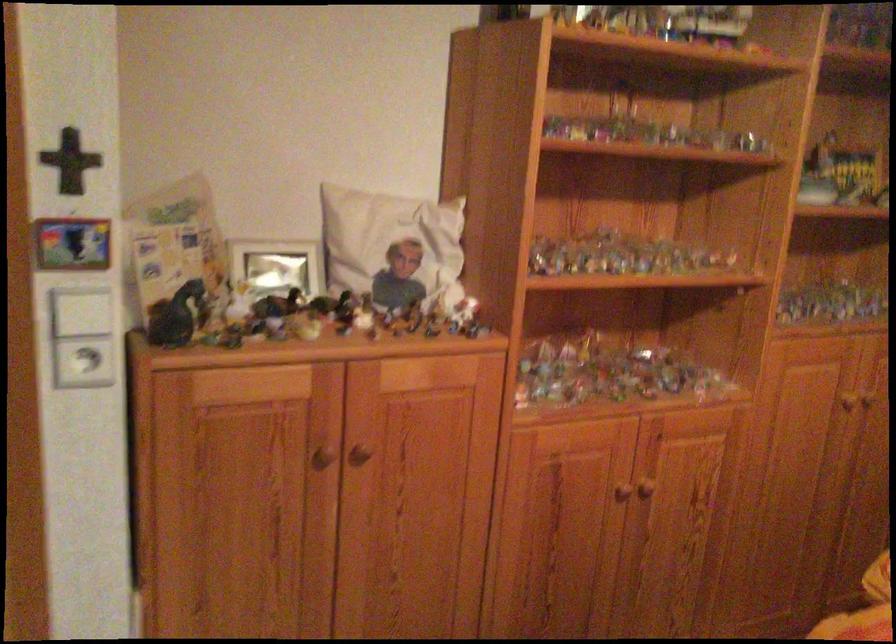
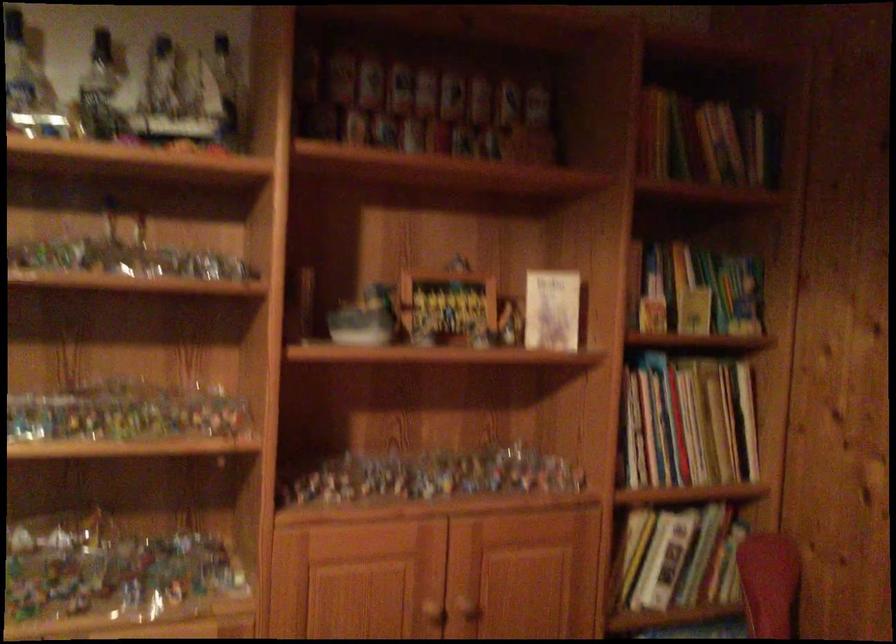
The images are taken continuously from a first-person perspective. In which direction are you moving?

The cameraman walked toward right, forward.